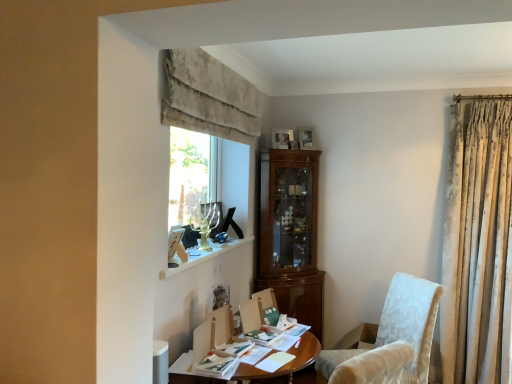
Question: Considering the relative sizes of wooden photo frame at upper center, which is the second picture frame in back-to-front order, and white textured fabric chair at lower right in the image provided, is wooden photo frame at upper center, which is the second picture frame in back-to-front order, wider than white textured fabric chair at lower right?

Choices:
 (A) yes
 (B) no

Answer: (B)

Question: Considering the relative sizes of wooden photo frame at upper center, which is the second picture frame in back-to-front order, and white textured fabric chair at lower right in the image provided, is wooden photo frame at upper center, which is the second picture frame in back-to-front order, thinner than white textured fabric chair at lower right?

Choices:
 (A) yes
 (B) no

Answer: (A)

Question: Is wooden photo frame at upper center, arranged as the 1th picture frame when viewed from the front, shorter than white textured fabric chair at lower right?

Choices:
 (A) no
 (B) yes

Answer: (B)

Question: Is the depth of wooden photo frame at upper center, arranged as the 1th picture frame when viewed from the front, less than that of white textured fabric chair at lower right?

Choices:
 (A) no
 (B) yes

Answer: (A)

Question: Are wooden photo frame at upper center, arranged as the 1th picture frame when viewed from the front, and white textured fabric chair at lower right located far from each other?

Choices:
 (A) no
 (B) yes

Answer: (B)

Question: Based on their sizes in the image, would you say velvet beige curtain at upper center is bigger or smaller than wooden photo frame at upper center, placed as the 1th picture frame when sorted from left to right?

Choices:
 (A) big
 (B) small

Answer: (A)

Question: From their relative heights in the image, would you say velvet beige curtain at upper center is taller or shorter than wooden photo frame at upper center, which is the second picture frame in back-to-front order?

Choices:
 (A) short
 (B) tall

Answer: (B)

Question: Is velvet beige curtain at upper center to the left or to the right of wooden photo frame at upper center, which is the second picture frame in back-to-front order, in the image?

Choices:
 (A) left
 (B) right

Answer: (A)

Question: Does point (232, 125) appear closer or farther from the camera than point (280, 135)?

Choices:
 (A) closer
 (B) farther

Answer: (A)

Question: Relative to wooden photo frame at upper center, acting as the 2th picture frame starting from the right, is wooden desk at center in front or behind?

Choices:
 (A) front
 (B) behind

Answer: (A)

Question: Choose the correct answer: Is wooden desk at center inside wooden photo frame at upper center, placed as the 1th picture frame when sorted from left to right, or outside it?

Choices:
 (A) outside
 (B) inside

Answer: (A)

Question: Is wooden desk at center wider or thinner than wooden photo frame at upper center, placed as the 1th picture frame when sorted from left to right?

Choices:
 (A) thin
 (B) wide

Answer: (B)

Question: Is point (241, 369) positioned closer to the camera than point (282, 145)?

Choices:
 (A) farther
 (B) closer

Answer: (B)

Question: Is white marble window sill at upper center to the left or to the right of wooden photo frame at upper center, acting as the 2th picture frame starting from the right, in the image?

Choices:
 (A) left
 (B) right

Answer: (A)

Question: Is white marble window sill at upper center wider or thinner than wooden photo frame at upper center, which is the second picture frame in back-to-front order?

Choices:
 (A) wide
 (B) thin

Answer: (A)